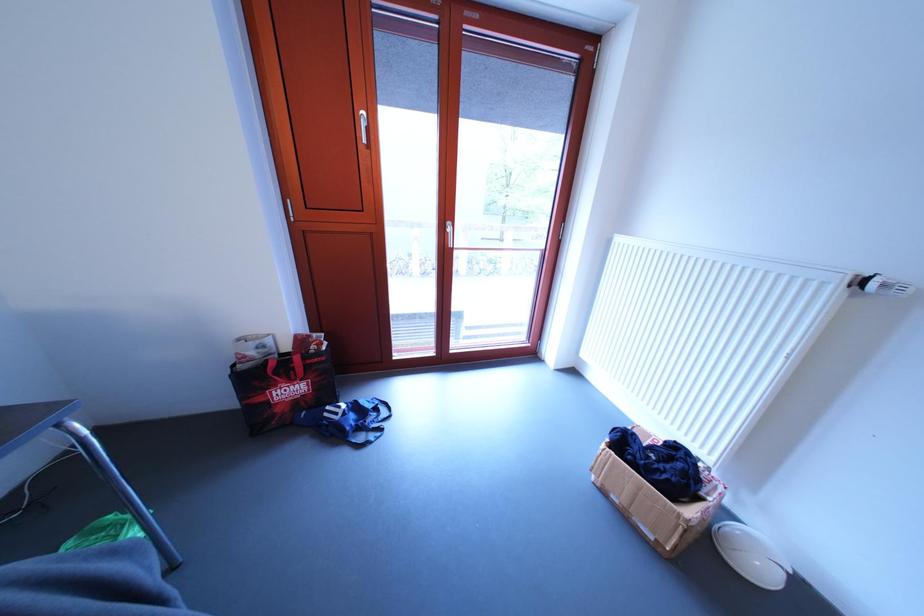
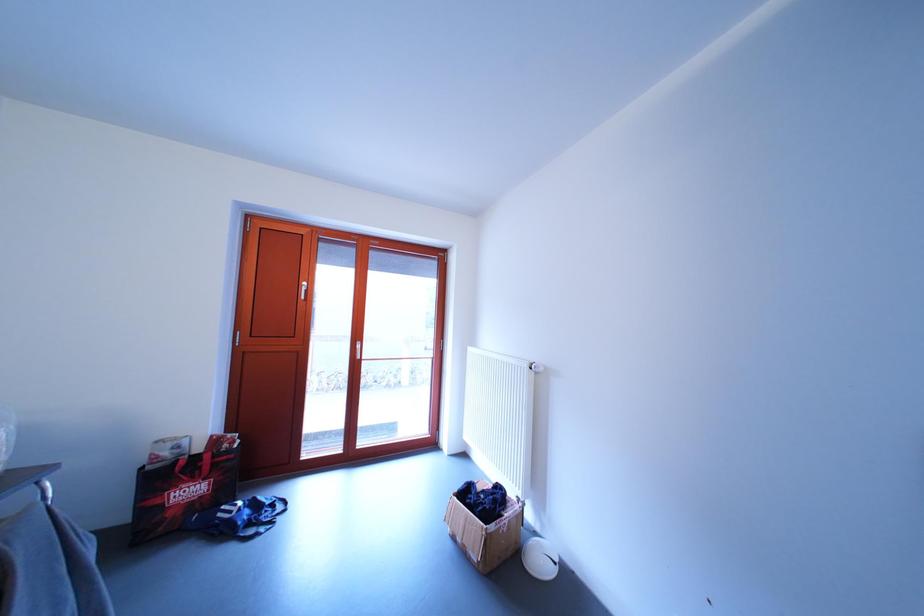
Question: The images are taken continuously from a first-person perspective. In which direction is your viewpoint rotating?

Choices:
 (A) Left
 (B) Right
 (C) Up
 (D) Down

Answer: (C)